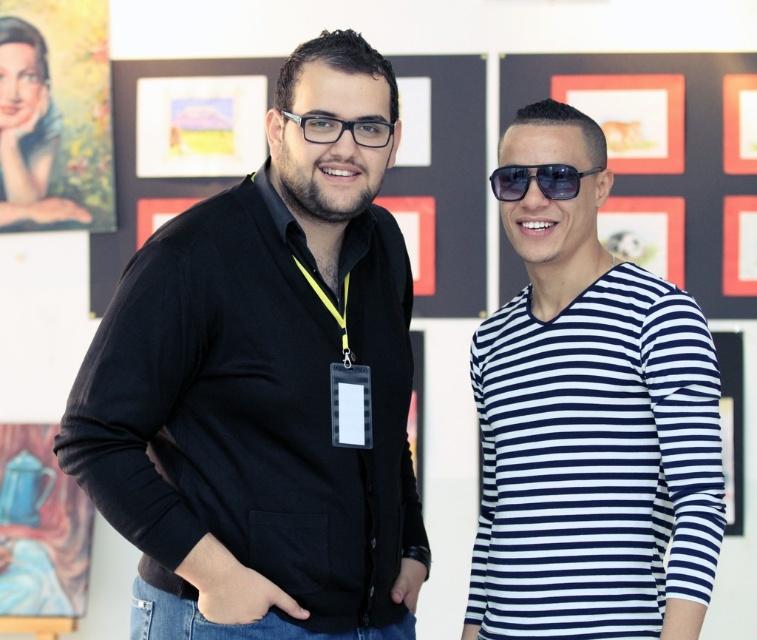
Can you confirm if black matte cardigan at left is shorter than transparent plastic glasses at center?

No.

Identify the location of black matte cardigan at left. (263, 388).

Locate an element on the screen. This screenshot has width=757, height=640. black matte cardigan at left is located at coordinates (263, 388).

Does white striped shirt at right appear on the left side of sunglasses at center?

No, white striped shirt at right is not to the left of sunglasses at center.

Does white striped shirt at right lie in front of sunglasses at center?

That is True.

This screenshot has width=757, height=640. Describe the element at coordinates (589, 422) in the screenshot. I see `white striped shirt at right` at that location.

The image size is (757, 640). I want to click on white striped shirt at right, so click(x=589, y=422).

The width and height of the screenshot is (757, 640). Describe the element at coordinates (263, 388) in the screenshot. I see `black matte cardigan at left` at that location.

Does point (284, 444) lie behind point (506, 188)?

No, (284, 444) is closer to viewer.

Locate an element on the screen. The height and width of the screenshot is (640, 757). black matte cardigan at left is located at coordinates (263, 388).